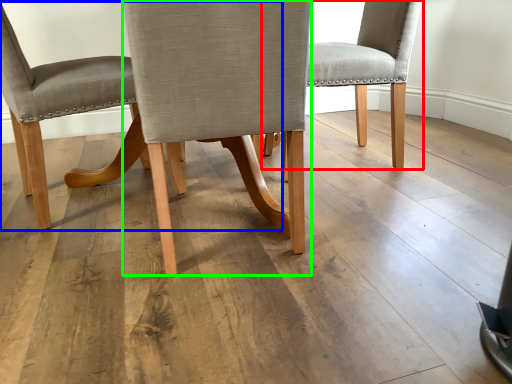
Question: Which is nearer to the chair (highlighted by a red box)? chair (highlighted by a blue box) or chair (highlighted by a green box).

Choices:
 (A) chair
 (B) chair

Answer: (B)